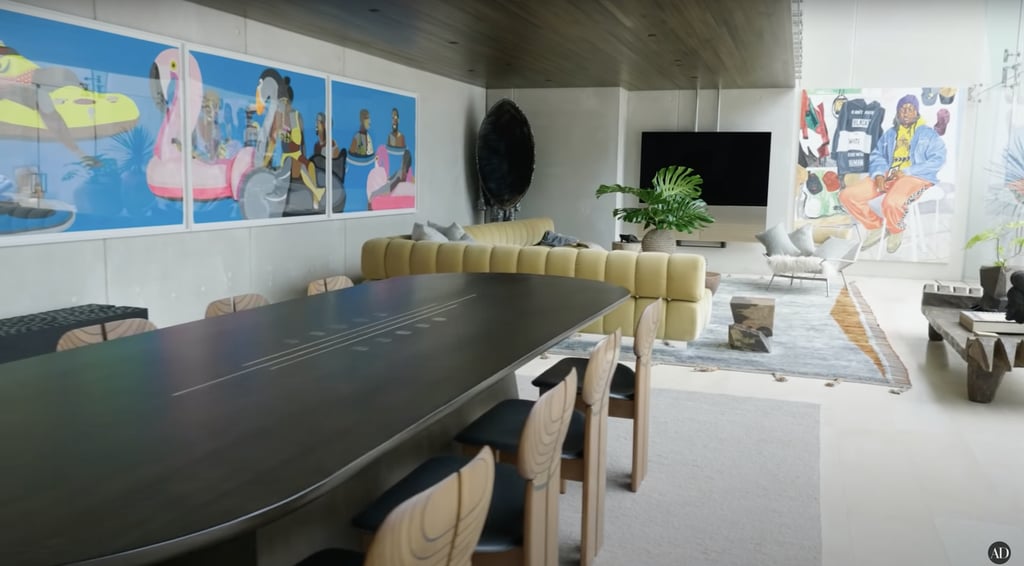
This screenshot has height=566, width=1024. What are the coordinates of `large rug` in the screenshot? It's located at (800, 347), (784, 513).